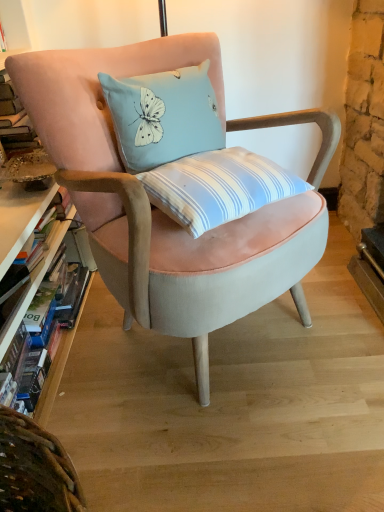
I want to click on vacant space in velvet pink chair at center (from a real-world perspective), so [x=207, y=342].